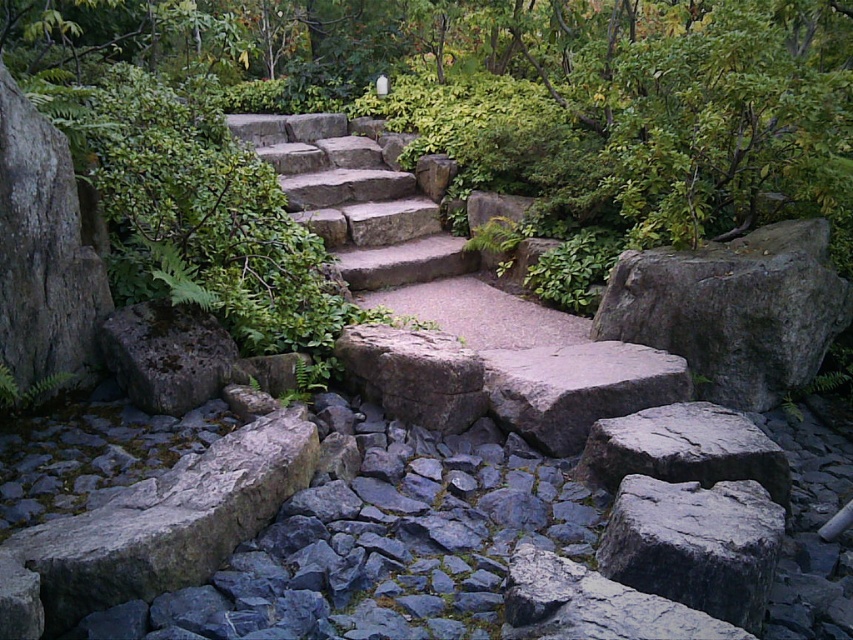
You are a hiker carrying a heavy backpack and need to climb the natural stone stairs at center. There is also a gray rough rock at lower right nearby. Which object would require more effort to climb due to its size?

The natural stone stairs at center would require more effort to climb because it is bigger than the gray rough rock at lower right.